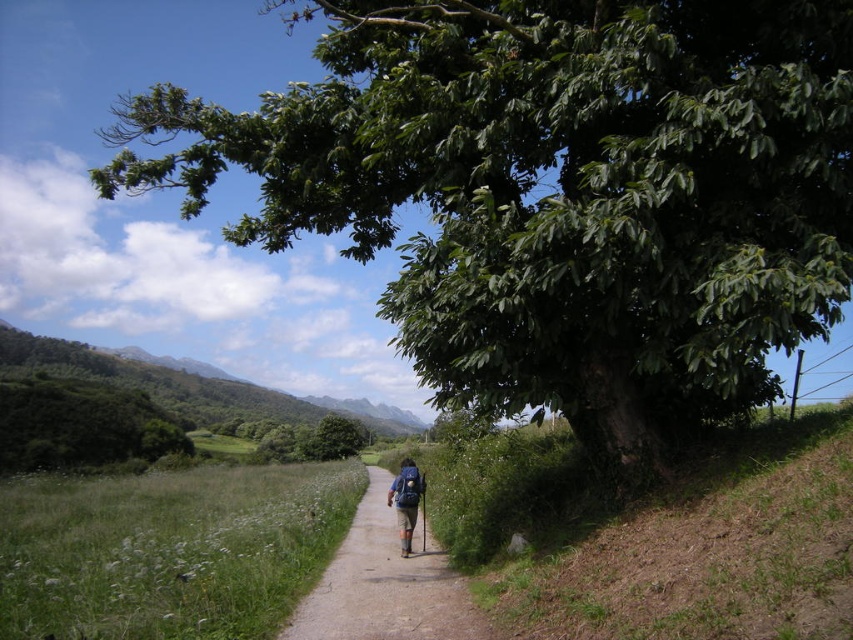
You are a hiker carrying the blue fabric backpack at center and want to take a photo of the green leafy tree at upper right. Since the backpack might block your view, can you estimate if the tree is wider than the backpack?

The green leafy tree at upper right might be wider than blue fabric backpack at center, so there is a possibility that the tree is wider than the backpack. You should adjust your position to ensure the backpack doesn not block the view.

You are a hiker planning to rest under the shade of the green leafy tree at upper right while carrying your blue fabric backpack at center. Can you confirm if the tree is big enough to provide sufficient shade for both you and your backpack?

The green leafy tree at upper right has a larger size compared to the blue fabric backpack at center, so it is likely big enough to provide sufficient shade for both you and your backpack.

You are a hiker trying to decide whether to place your blue fabric backpack at center on the brown dirt path at center. Considering the space available on the path, will the backpack fit without overlapping the path?

The brown dirt path at center has a larger size compared to blue fabric backpack at center, so the backpack will fit on the path without overlapping the edges.